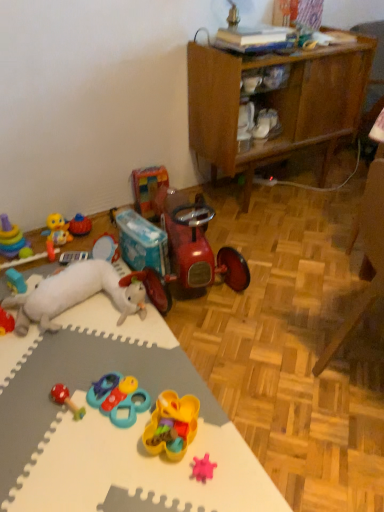
Question: Based on their sizes in the image, would you say teal plastic toy at center, the 5th toy viewed from the right, is bigger or smaller than white matte shoe at center?

Choices:
 (A) big
 (B) small

Answer: (B)

Question: From their relative heights in the image, would you say teal plastic toy at center, the eighth toy viewed from the left, is taller or shorter than white matte shoe at center?

Choices:
 (A) short
 (B) tall

Answer: (A)

Question: Which object is the farthest from the rubberized red and green toy at lower left, the 7th toy from the left?

Choices:
 (A) rubberized plastic toy at left, the eleventh toy positioned from the right
 (B) white foam mat at lower left
 (C) wooden cabinet at upper right
 (D) pink rubber star at lower center, placed as the twelfth toy when sorted from left to right
 (E) rubber teething ring at lower left, which is the 10th toy from right to left

Answer: (C)

Question: Based on their relative distances, which object is farther from the shiny red tricycle at center, which appears as the 10th toy when viewed from the left?

Choices:
 (A) white plush toy at upper left, the 5th toy positioned from the left
 (B) rubber duck at left, the 4th toy from the left
 (C) wooden cabinet at upper right
 (D) translucent yellow plastic toy at center, marked as the 11th toy in a left-to-right arrangement
 (E) teal plastic toy at center, the eighth toy viewed from the left

Answer: (B)